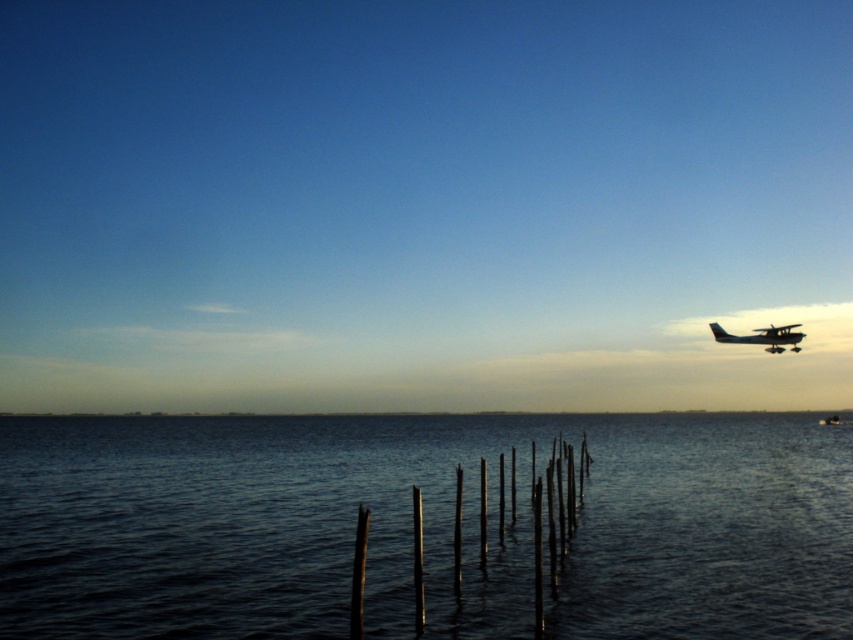
Is metallic silver airplane at upper right thinner than metallic silver boat at right?

Yes, metallic silver airplane at upper right is thinner than metallic silver boat at right.

Looking at this image, is metallic silver airplane at upper right further to the viewer compared to metallic silver boat at right?

No, it is not.

The width and height of the screenshot is (853, 640). Describe the element at coordinates (762, 337) in the screenshot. I see `metallic silver airplane at upper right` at that location.

At what (x,y) coordinates should I click in order to perform the action: click on metallic silver airplane at upper right. Please return your answer as a coordinate pair (x, y). Image resolution: width=853 pixels, height=640 pixels. Looking at the image, I should click on 762,337.

Who is taller, dark blue water at center or metallic silver airplane at upper right?

dark blue water at center

Who is more distant from viewer, (648, 461) or (781, 342)?

Positioned behind is point (648, 461).

Does point (86, 570) lie behind point (773, 332)?

No, it is not.

I want to click on dark blue water at center, so click(x=422, y=525).

Which of these two, dark blue water at center or metallic silver boat at right, stands shorter?

Standing shorter between the two is metallic silver boat at right.

Is point (380, 486) in front of point (817, 422)?

Yes, it is in front of point (817, 422).

Does point (520, 570) lie in front of point (846, 422)?

Yes.

Where is `dark blue water at center`? dark blue water at center is located at coordinates coord(422,525).